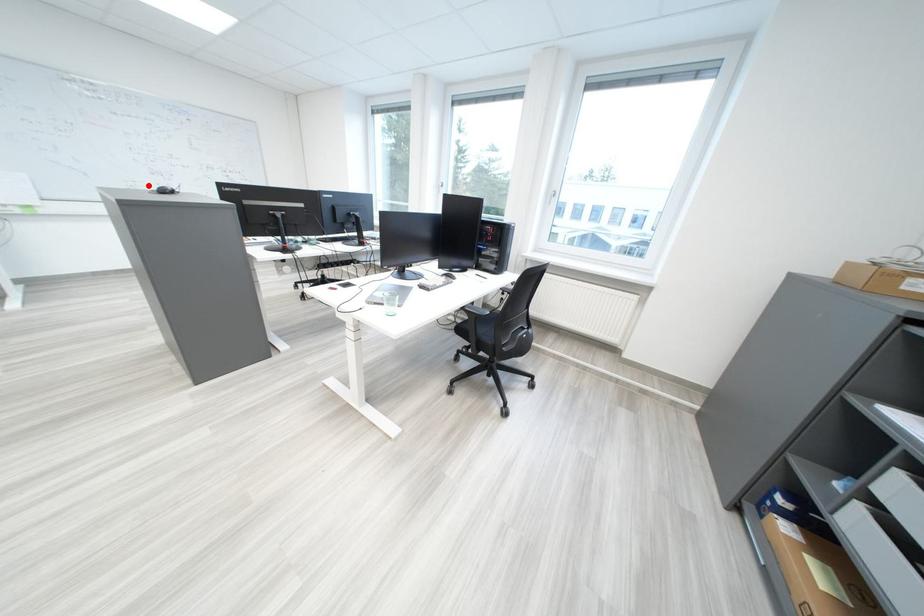
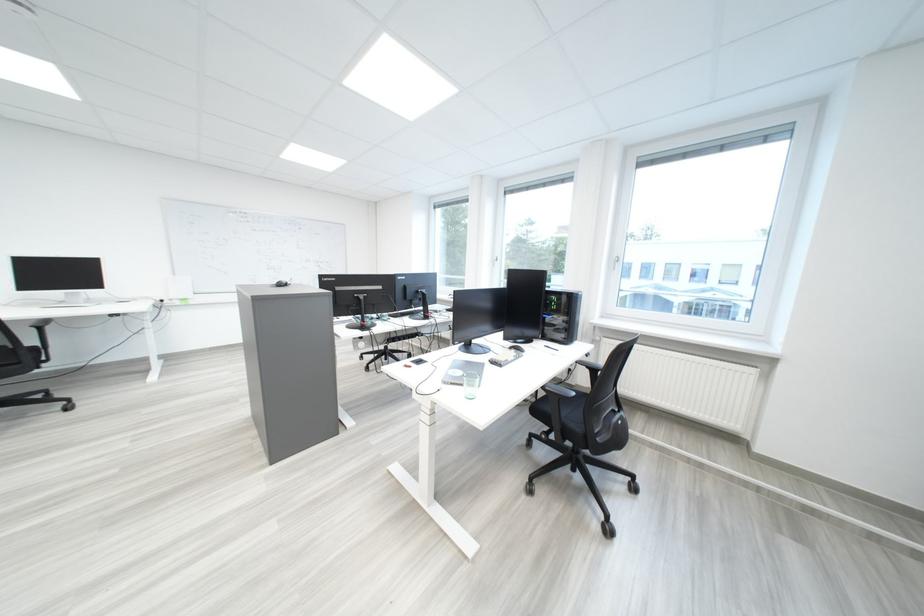
The point at the highlighted location is marked in the first image. Where is the corresponding point in the second image?

(275, 283)